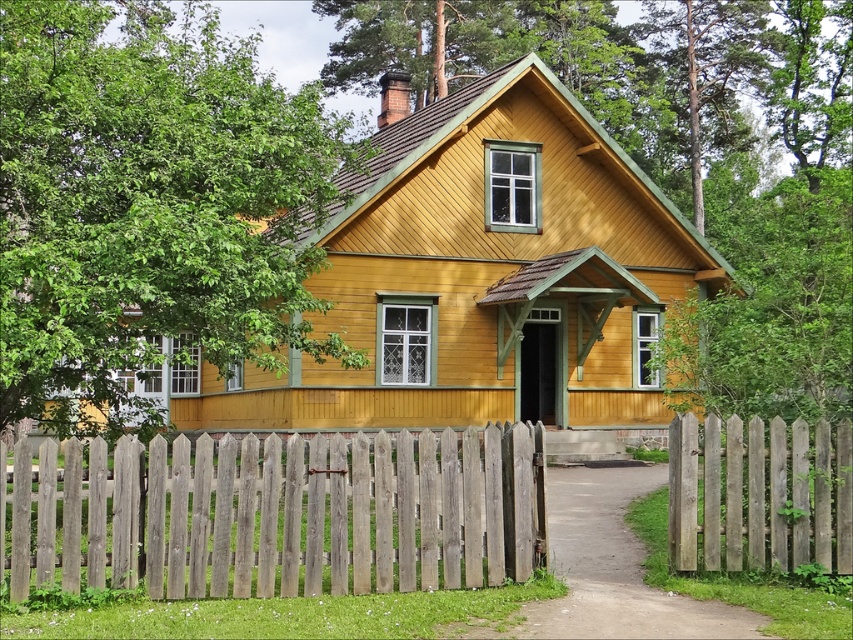
Based on the photo, you are standing in front of the traditional wooden house and want to take a photo of the green leafy tree at upper left. Based on its position, which direction should you face to capture it in your shot?

The green leafy tree at upper left is located at point (149, 205), which means it is positioned towards the upper left corner of the scene. To capture it in your photo, you should face towards the upper left direction from your current position in front of the house.

Consider the image. You are standing at the entrance of the traditional wooden house and want to see the weathered wood fence at center. In which direction should you look?

You should look towards the center of the image, where the weathered wood fence at center is located at point coordinates of (280,513).

You are standing in front of the traditional wooden house and notice the green leafy tree at upper left and the weathered wood fence at lower right. Which object appears larger in the image?

The green leafy tree at upper left appears larger than the weathered wood fence at lower right in the image.